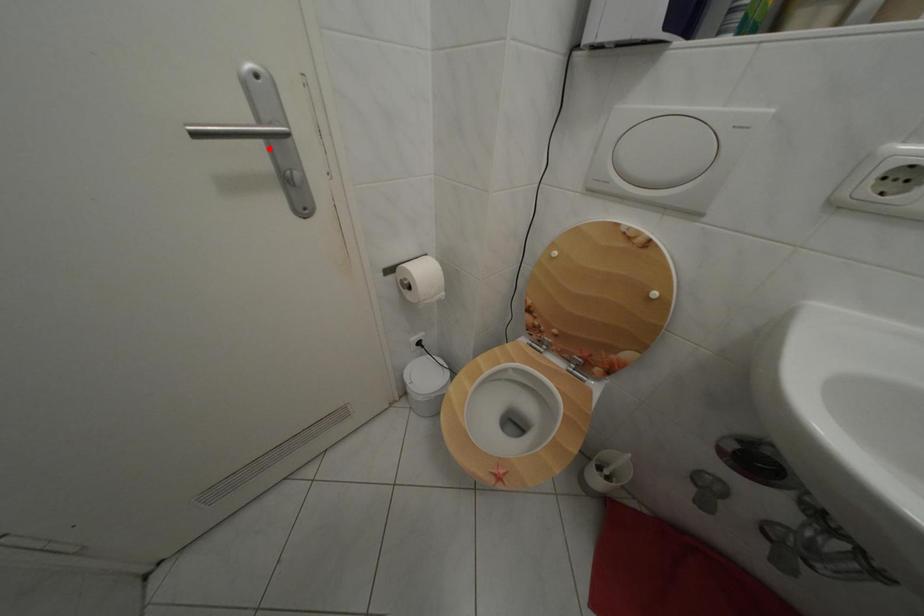
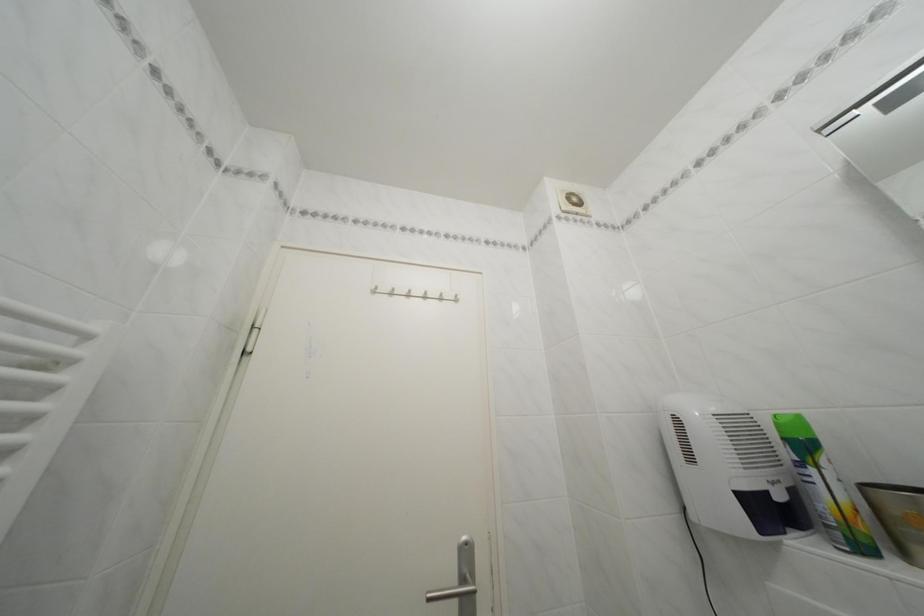
The point at the highlighted location is marked in the first image. Where is the corresponding point in the second image?

(468, 608)